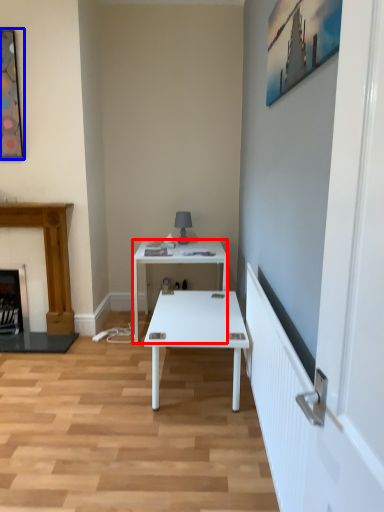
Question: Which of the following is the closest to the observer, desk (highlighted by a red box) or picture frame (highlighted by a blue box)?

Choices:
 (A) desk
 (B) picture frame

Answer: (B)